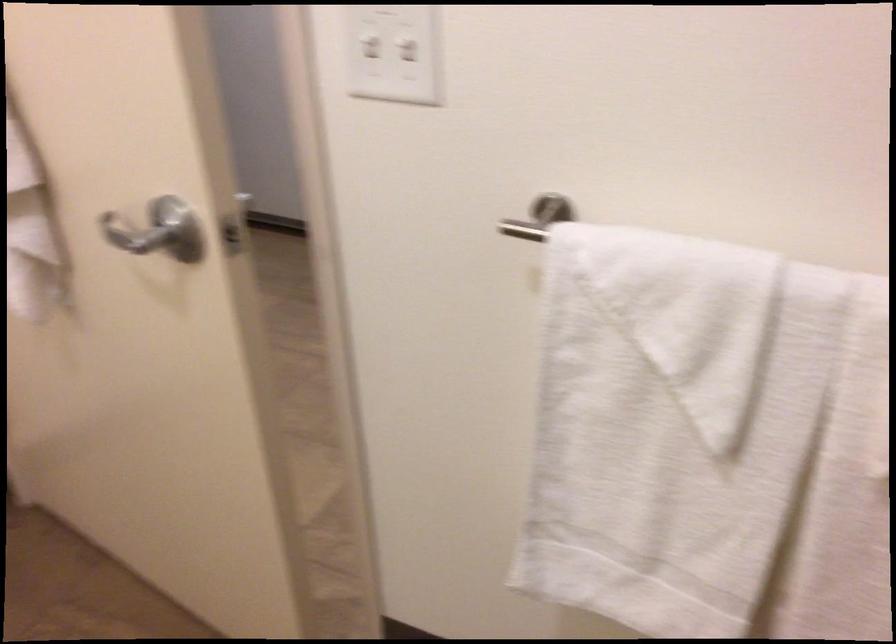
The images are taken continuously from a first-person perspective. In which direction is your viewpoint rotating?

The rotation direction of the camera is left-down.